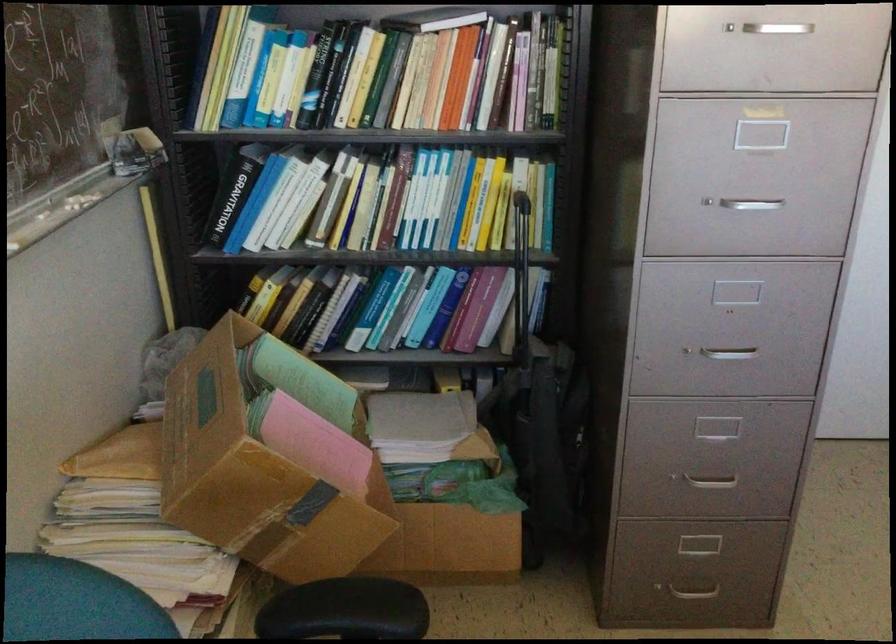
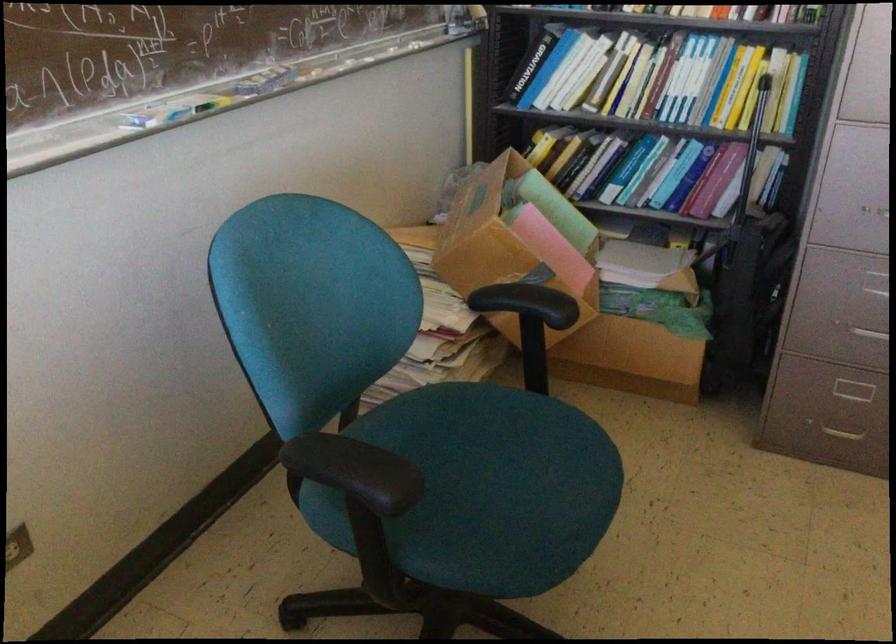
Where in the second image is the point corresponding to (x=455, y=328) from the first image?

(692, 194)